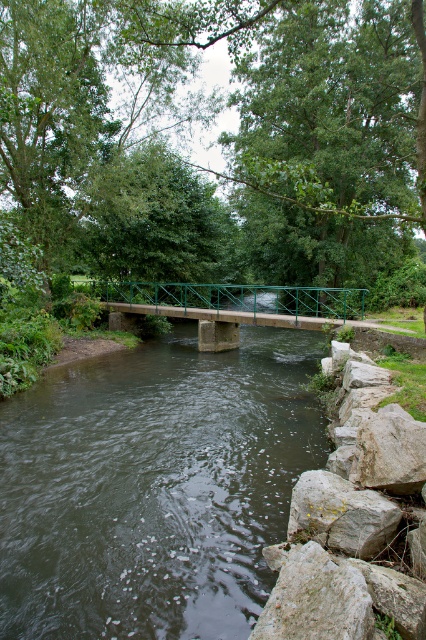
Question: Does gray rough rock at lower right appear over brown rough rock at lower right?

Choices:
 (A) no
 (B) yes

Answer: (A)

Question: Which of these objects is positioned closest to the green metal bridge at center?

Choices:
 (A) green leafy tree at center
 (B) gray rough rock at lower right
 (C) dark green water at center

Answer: (A)

Question: Which of these objects is positioned closest to the brown rough rock at lower right?

Choices:
 (A) green leafy tree at center
 (B) dark green water at center
 (C) green metal bridge at center

Answer: (B)

Question: Does gray rough rock at lower right have a larger size compared to green metal bridge at center?

Choices:
 (A) no
 (B) yes

Answer: (A)

Question: Which point is closer to the camera taking this photo?

Choices:
 (A) [58, 19]
 (B) [71, 369]

Answer: (B)

Question: Does dark green water at center appear under brown rough rock at lower right?

Choices:
 (A) no
 (B) yes

Answer: (B)